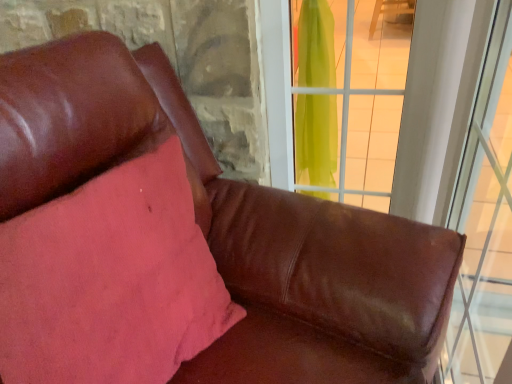
Describe the element at coordinates (111, 281) in the screenshot. I see `pink fabric pillow at upper left` at that location.

What are the coordinates of `transparent green curtain at upper right, marked as the 2th window in a right-to-left arrangement` in the screenshot? It's located at (349, 96).

Which of these two, transparent glass window at right, which ranks as the second window in left-to-right order, or transparent green curtain at upper right, the first window in the left-to-right sequence, is thinner?

transparent green curtain at upper right, the first window in the left-to-right sequence.

Which is more to the left, transparent glass window at right, which ranks as the second window in left-to-right order, or transparent green curtain at upper right, marked as the 2th window in a right-to-left arrangement?

transparent green curtain at upper right, marked as the 2th window in a right-to-left arrangement.

Based on the photo, is there a large distance between transparent glass window at right, the 1th window positioned from the right, and transparent green curtain at upper right, marked as the 2th window in a right-to-left arrangement?

That's not correct — transparent glass window at right, the 1th window positioned from the right, is a little close to transparent green curtain at upper right, marked as the 2th window in a right-to-left arrangement.

Considering the sizes of objects pink fabric pillow at upper left and transparent glass window at right, the 1th window positioned from the right, in the image provided, who is bigger, pink fabric pillow at upper left or transparent glass window at right, the 1th window positioned from the right,?

transparent glass window at right, the 1th window positioned from the right.

From a real-world perspective, does pink fabric pillow at upper left stand above transparent glass window at right, which ranks as the second window in left-to-right order?

Yes, from a real-world perspective, pink fabric pillow at upper left is on top of transparent glass window at right, which ranks as the second window in left-to-right order.

Is pink fabric pillow at upper left inside the boundaries of transparent glass window at right, which ranks as the second window in left-to-right order, or outside?

pink fabric pillow at upper left is outside transparent glass window at right, which ranks as the second window in left-to-right order.

Is transparent green curtain at upper right, marked as the 2th window in a right-to-left arrangement, looking in the opposite direction of transparent glass window at right, which ranks as the second window in left-to-right order?

transparent green curtain at upper right, marked as the 2th window in a right-to-left arrangement, does not have its back to transparent glass window at right, which ranks as the second window in left-to-right order.

How many degrees apart are the facing directions of transparent green curtain at upper right, marked as the 2th window in a right-to-left arrangement, and transparent glass window at right, which ranks as the second window in left-to-right order?

The angular difference between transparent green curtain at upper right, marked as the 2th window in a right-to-left arrangement, and transparent glass window at right, which ranks as the second window in left-to-right order, is 90.7 degrees.

You are a GUI agent. You are given a task and a screenshot of the screen. Output one action in this format:
    pyautogui.click(x=<x>, y=<y>)
    Task: Click on the window below the transparent green curtain at upper right, marked as the 2th window in a right-to-left arrangement (from the image's perspective)
    Image resolution: width=512 pixels, height=384 pixels.
    Given the screenshot: What is the action you would take?
    pyautogui.click(x=484, y=222)

Is transparent green curtain at upper right, marked as the 2th window in a right-to-left arrangement, positioned far away from transparent glass window at right, which ranks as the second window in left-to-right order?

Actually, transparent green curtain at upper right, marked as the 2th window in a right-to-left arrangement, and transparent glass window at right, which ranks as the second window in left-to-right order, are a little close together.

Can you confirm if transparent glass window at right, the 1th window positioned from the right, is bigger than pink fabric pillow at upper left?

Yes.

From a real-world perspective, relative to pink fabric pillow at upper left, is transparent glass window at right, which ranks as the second window in left-to-right order, vertically above or below?

Clearly, from a real-world perspective, transparent glass window at right, which ranks as the second window in left-to-right order, is below pink fabric pillow at upper left.

In the scene shown: Between transparent glass window at right, the 1th window positioned from the right, and pink fabric pillow at upper left, which one has less height?

With less height is pink fabric pillow at upper left.

Does pink fabric pillow at upper left have a greater height compared to transparent green curtain at upper right, marked as the 2th window in a right-to-left arrangement?

Indeed, pink fabric pillow at upper left has a greater height compared to transparent green curtain at upper right, marked as the 2th window in a right-to-left arrangement.

You are a GUI agent. You are given a task and a screenshot of the screen. Output one action in this format:
    pyautogui.click(x=<x>, y=<y>)
    Task: Click on the 1st window to the right when counting from the pink fabric pillow at upper left
    The image size is (512, 384).
    Given the screenshot: What is the action you would take?
    pyautogui.click(x=349, y=96)

From the image's perspective, is pink fabric pillow at upper left located above or below transparent green curtain at upper right, the first window in the left-to-right sequence?

pink fabric pillow at upper left is situated lower than transparent green curtain at upper right, the first window in the left-to-right sequence, in the image.

Is pink fabric pillow at upper left oriented towards transparent green curtain at upper right, the first window in the left-to-right sequence?

No, pink fabric pillow at upper left is not turned towards transparent green curtain at upper right, the first window in the left-to-right sequence.

Is transparent green curtain at upper right, marked as the 2th window in a right-to-left arrangement, looking in the opposite direction of pink fabric pillow at upper left?

No, transparent green curtain at upper right, marked as the 2th window in a right-to-left arrangement,'s orientation is not away from pink fabric pillow at upper left.

Between point (328, 85) and point (148, 177), which one is positioned in front?

Point (148, 177)

From a real-world perspective, between transparent green curtain at upper right, marked as the 2th window in a right-to-left arrangement, and pink fabric pillow at upper left, who is vertically lower?

pink fabric pillow at upper left, from a real-world perspective.

Would you say transparent green curtain at upper right, marked as the 2th window in a right-to-left arrangement, is to the left or to the right of pink fabric pillow at upper left in the picture?

transparent green curtain at upper right, marked as the 2th window in a right-to-left arrangement, is positioned on pink fabric pillow at upper left's right side.

Identify the location of window below the transparent green curtain at upper right, the first window in the left-to-right sequence (from a real-world perspective). pyautogui.click(x=484, y=222).

Where is `the 2nd window counting from the right of the pink fabric pillow at upper left`? This screenshot has width=512, height=384. the 2nd window counting from the right of the pink fabric pillow at upper left is located at coordinates (484, 222).

When comparing their distances from pink fabric pillow at upper left, does transparent glass window at right, the 1th window positioned from the right, or transparent green curtain at upper right, marked as the 2th window in a right-to-left arrangement, seem further?

Among the two, transparent green curtain at upper right, marked as the 2th window in a right-to-left arrangement, is located further to pink fabric pillow at upper left.

Considering their positions, is transparent green curtain at upper right, the first window in the left-to-right sequence, positioned closer to pink fabric pillow at upper left than transparent glass window at right, the 1th window positioned from the right?

transparent glass window at right, the 1th window positioned from the right, lies closer to pink fabric pillow at upper left than the other object.

When comparing their distances from transparent green curtain at upper right, the first window in the left-to-right sequence, does pink fabric pillow at upper left or transparent glass window at right, the 1th window positioned from the right, seem closer?

Based on the image, transparent glass window at right, the 1th window positioned from the right, appears to be nearer to transparent green curtain at upper right, the first window in the left-to-right sequence.

Which object lies further to the anchor point transparent glass window at right, which ranks as the second window in left-to-right order, pink fabric pillow at upper left or transparent green curtain at upper right, marked as the 2th window in a right-to-left arrangement?

pink fabric pillow at upper left is further to transparent glass window at right, which ranks as the second window in left-to-right order.

Estimate the real-world distances between objects in this image. Which object is closer to transparent glass window at right, the 1th window positioned from the right, transparent green curtain at upper right, marked as the 2th window in a right-to-left arrangement, or pink fabric pillow at upper left?

Based on the image, transparent green curtain at upper right, marked as the 2th window in a right-to-left arrangement, appears to be nearer to transparent glass window at right, the 1th window positioned from the right.

From the image, which object appears to be nearer to transparent green curtain at upper right, marked as the 2th window in a right-to-left arrangement, transparent glass window at right, which ranks as the second window in left-to-right order, or pink fabric pillow at upper left?

The object closer to transparent green curtain at upper right, marked as the 2th window in a right-to-left arrangement, is transparent glass window at right, which ranks as the second window in left-to-right order.

The height and width of the screenshot is (384, 512). I want to click on window between pink fabric pillow at upper left and transparent glass window at right, the 1th window positioned from the right, in the horizontal direction, so click(349, 96).